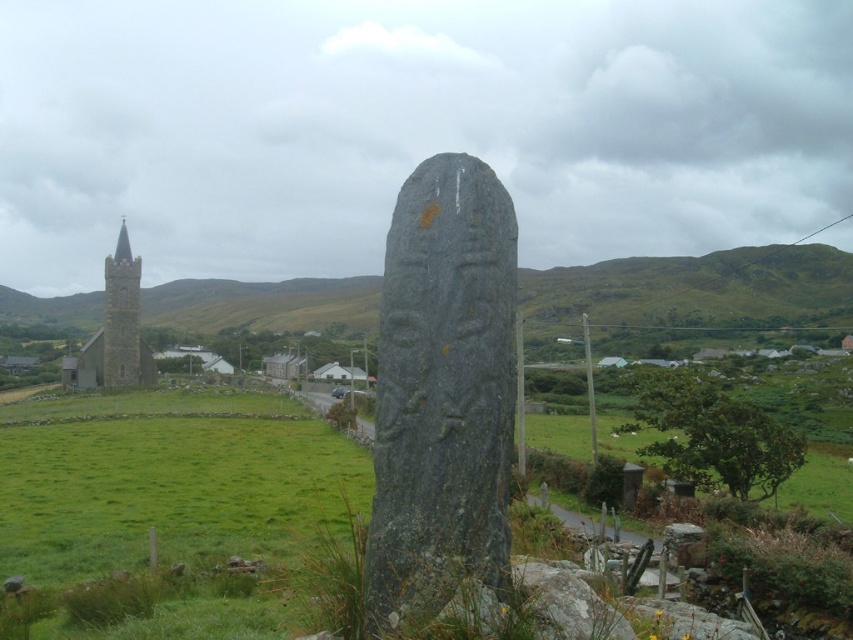
Question: Which object appears farthest from the camera in this image?

Choices:
 (A) smooth stone tower at left
 (B) green grassy hillside at left

Answer: (A)

Question: Does green grassy hillside at left appear on the right side of dark gray stone church at left?

Choices:
 (A) no
 (B) yes

Answer: (B)

Question: Considering the relative positions of dark gray stone church at left and smooth stone tower at left in the image provided, where is dark gray stone church at left located with respect to smooth stone tower at left?

Choices:
 (A) above
 (B) below

Answer: (B)

Question: Is green grassy hillside at left closer to camera compared to dark gray stone church at left?

Choices:
 (A) yes
 (B) no

Answer: (A)

Question: Which object appears farthest from the camera in this image?

Choices:
 (A) green grassy hillside at left
 (B) dark gray stone church at left
 (C) smooth stone tower at left

Answer: (C)

Question: Estimate the real-world distances between objects in this image. Which object is closer to the green grassy hillside at left?

Choices:
 (A) smooth stone tower at left
 (B) dark gray stone church at left

Answer: (B)